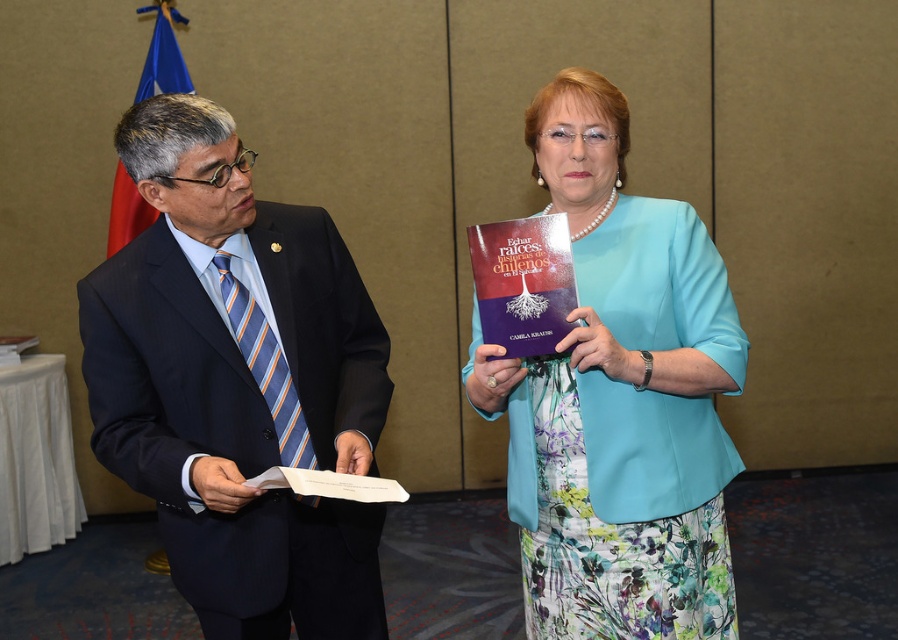
You are a photographer adjusting your camera to focus on two specific points in the image. The first point is at coordinates point (192, 177) and the second is at point (728, 349). Which point should you focus on first if you want to ensure the closest object is in sharp focus?

Point (192, 177) is closer to the camera than point (728, 349), so you should focus on point (192, 177) first to ensure the closest object is in sharp focus.